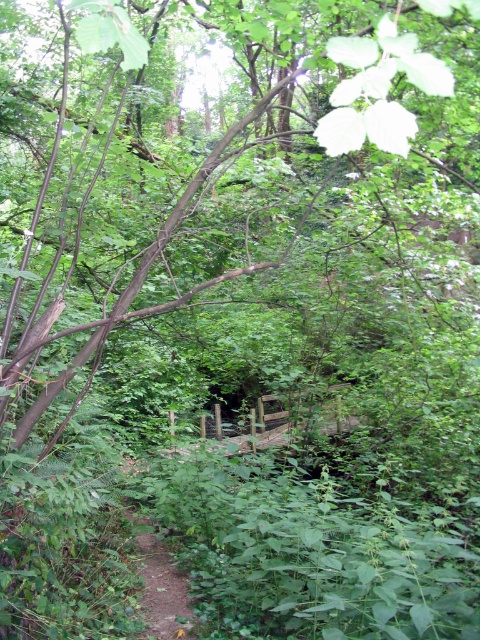
You are standing at the point closer to the camera in the forest scene. Which point are you at, point (x=86, y=124) or point (x=170, y=579)?

You are at point (x=86, y=124) because it is further to the camera than point (x=170, y=579).

You are a hiker navigating through the forest and want to reach the wooden bridge. You see the brown wood tree at center and the brown dirt path at lower left. Which object should you follow to find the bridge?

The brown dirt path at lower left leads towards the bridge, so you should follow the brown dirt path at lower left. The brown wood tree at center is above it but does not indicate the bridge location.